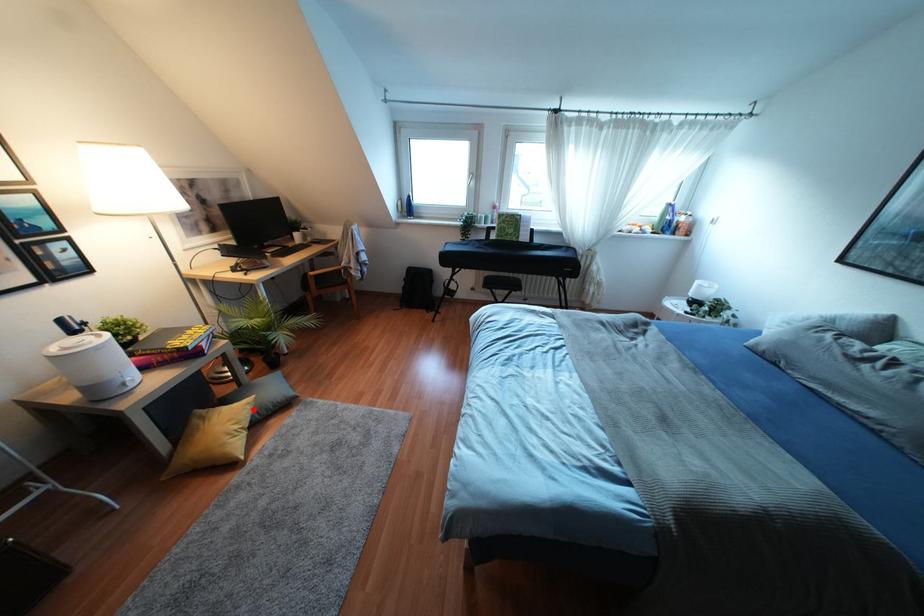
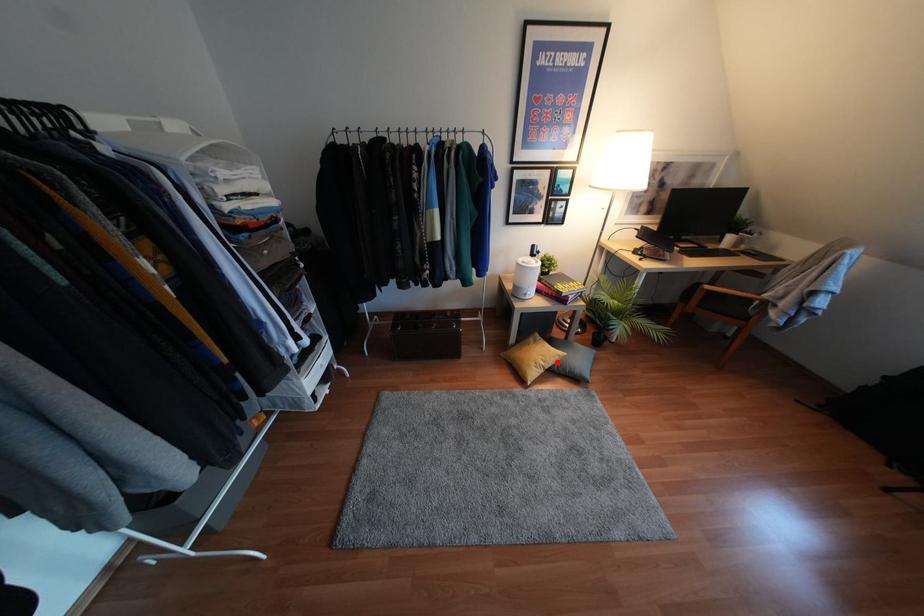
I am providing you with two images of the same scene from different viewpoints. A red point is marked on the first image and another point is marked on the second image. Do the highlighted points in image1 and image2 indicate the same real-world spot?

Yes